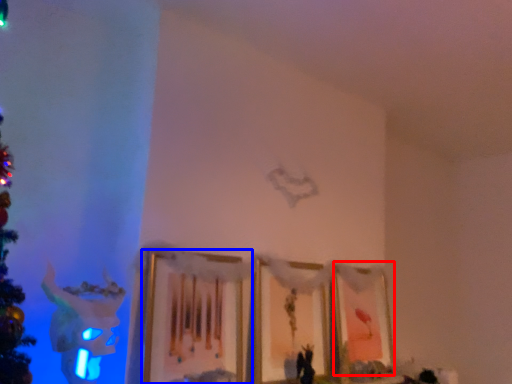
Question: Which of the following is the closest to the observer, picture frame (highlighted by a red box) or picture frame (highlighted by a blue box)?

Choices:
 (A) picture frame
 (B) picture frame

Answer: (B)